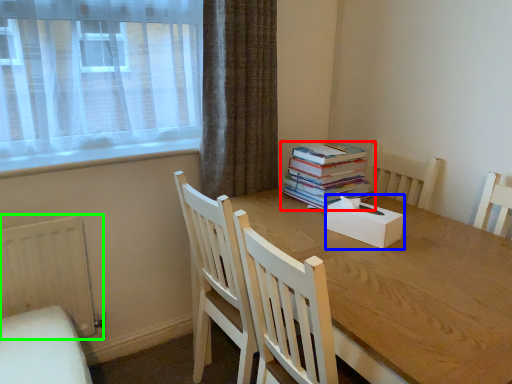
Question: Based on their relative distances, which object is farther from book (highlighted by a red box)? Choose from box (highlighted by a blue box) and radiator (highlighted by a green box).

Choices:
 (A) box
 (B) radiator

Answer: (B)